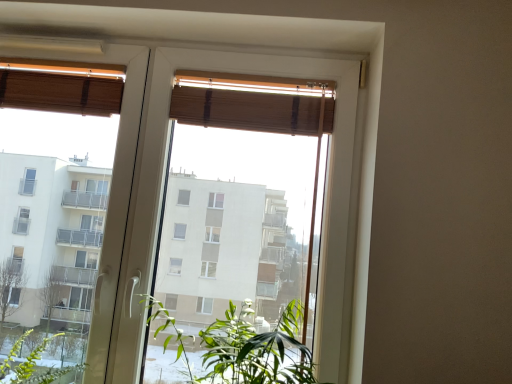
Image resolution: width=512 pixels, height=384 pixels. Find the location of `wooden blind at upper left, arranged as the 1th curtain when viewed from the left`. wooden blind at upper left, arranged as the 1th curtain when viewed from the left is located at coordinates (60, 93).

The height and width of the screenshot is (384, 512). What do you see at coordinates (242, 348) in the screenshot? I see `green leafy plant at center` at bounding box center [242, 348].

Locate an element on the screen. Image resolution: width=512 pixels, height=384 pixels. wooden blind at upper left, which ranks as the 2th curtain in right-to-left order is located at coordinates (60, 93).

From the image's perspective, which one is positioned lower, wooden blinds at upper center or wooden blind at upper left, which ranks as the 2th curtain in right-to-left order?

From the image's view, wooden blinds at upper center is below.

Where is `the 2nd curtain behind the wooden blinds at upper center, counting from the anchor's position`? Image resolution: width=512 pixels, height=384 pixels. the 2nd curtain behind the wooden blinds at upper center, counting from the anchor's position is located at coordinates (60, 93).

Considering the relative positions of wooden blinds at upper center and wooden blind at upper left, which ranks as the 2th curtain in right-to-left order, in the image provided, is wooden blinds at upper center behind wooden blind at upper left, which ranks as the 2th curtain in right-to-left order,?

That is False.

Considering the positions of objects wooden blinds at upper center and wooden blind at upper left, which ranks as the 2th curtain in right-to-left order, in the image provided, who is more to the left, wooden blinds at upper center or wooden blind at upper left, which ranks as the 2th curtain in right-to-left order,?

wooden blind at upper left, which ranks as the 2th curtain in right-to-left order, is more to the left.

Considering the relative sizes of green leafy plant at center and wooden blind at upper center, which is the 1th curtain from right to left, in the image provided, is green leafy plant at center bigger than wooden blind at upper center, which is the 1th curtain from right to left,?

Yes, green leafy plant at center is bigger than wooden blind at upper center, which is the 1th curtain from right to left.

Is point (244, 315) closer or farther from the camera than point (200, 89)?

Point (244, 315) appears to be closer to the viewer than point (200, 89).

Considering the positions of objects green leafy plant at center and wooden blind at upper center, which is the 2th curtain in left-to-right order, in the image provided, who is in front, green leafy plant at center or wooden blind at upper center, which is the 2th curtain in left-to-right order,?

green leafy plant at center is more forward.

Which is correct: green leafy plant at center is inside wooden blind at upper center, which is the 1th curtain from right to left, or outside of it?

green leafy plant at center is not inside wooden blind at upper center, which is the 1th curtain from right to left, it's outside.

Between green leafy plant at center and wooden blind at upper left, which ranks as the 2th curtain in right-to-left order, which one has larger size?

green leafy plant at center is bigger.

Is green leafy plant at center next to wooden blind at upper left, which ranks as the 2th curtain in right-to-left order?

No, green leafy plant at center is not beside wooden blind at upper left, which ranks as the 2th curtain in right-to-left order.

Which is in front, green leafy plant at center or wooden blind at upper left, arranged as the 1th curtain when viewed from the left?

green leafy plant at center is in front.

Is point (227, 322) closer or farther from the camera than point (70, 85)?

Point (227, 322).

Based on the photo, from a real-world perspective, is wooden blind at upper left, arranged as the 1th curtain when viewed from the left, positioned above or below green leafy plant at center?

wooden blind at upper left, arranged as the 1th curtain when viewed from the left, is above green leafy plant at center.

Consider the image. Looking at their sizes, would you say wooden blind at upper left, arranged as the 1th curtain when viewed from the left, is wider or thinner than green leafy plant at center?

Clearly, wooden blind at upper left, arranged as the 1th curtain when viewed from the left, has less width compared to green leafy plant at center.

Is wooden blind at upper left, arranged as the 1th curtain when viewed from the left, in front of or behind green leafy plant at center in the image?

Clearly, wooden blind at upper left, arranged as the 1th curtain when viewed from the left, is behind green leafy plant at center.

Is green leafy plant at center located within wooden blind at upper center, which is the 1th curtain from right to left?

No.

From the picture: Considering the relative sizes of wooden blind at upper center, which is the 2th curtain in left-to-right order, and green leafy plant at center in the image provided, is wooden blind at upper center, which is the 2th curtain in left-to-right order, taller than green leafy plant at center?

No, wooden blind at upper center, which is the 2th curtain in left-to-right order, is not taller than green leafy plant at center.

Considering the relative sizes of wooden blind at upper center, which is the 2th curtain in left-to-right order, and green leafy plant at center in the image provided, is wooden blind at upper center, which is the 2th curtain in left-to-right order, smaller than green leafy plant at center?

Correct, wooden blind at upper center, which is the 2th curtain in left-to-right order, occupies less space than green leafy plant at center.

Which of these two, wooden blind at upper center, which is the 2th curtain in left-to-right order, or green leafy plant at center, is wider?

green leafy plant at center is wider.

Is green leafy plant at center surrounding wooden blinds at upper center?

No, wooden blinds at upper center is not surrounded by green leafy plant at center.

Is green leafy plant at center smaller than wooden blinds at upper center?

Indeed, green leafy plant at center has a smaller size compared to wooden blinds at upper center.

From the picture: Is green leafy plant at center far away from wooden blinds at upper center?

No, green leafy plant at center is not far away from wooden blinds at upper center.

Is green leafy plant at center aimed at wooden blinds at upper center?

No, green leafy plant at center is not facing towards wooden blinds at upper center.

Is wooden blinds at upper center aimed at green leafy plant at center?

Yes, wooden blinds at upper center is facing green leafy plant at center.

Looking at this image, who is bigger, wooden blinds at upper center or green leafy plant at center?

With larger size is wooden blinds at upper center.

Would you consider wooden blinds at upper center to be distant from green leafy plant at center?

They are positioned close to each other.

Identify the location of window below the wooden blind at upper left, which ranks as the 2th curtain in right-to-left order (from a real-world perspective). The height and width of the screenshot is (384, 512). (162, 187).

Where is `curtain that appears on the right of green leafy plant at center`? curtain that appears on the right of green leafy plant at center is located at coordinates (246, 110).

Based on their spatial positions, is wooden blinds at upper center or green leafy plant at center closer to wooden blind at upper left, arranged as the 1th curtain when viewed from the left?

wooden blinds at upper center.

When comparing their distances from wooden blinds at upper center, does wooden blind at upper left, which ranks as the 2th curtain in right-to-left order, or green leafy plant at center seem closer?

wooden blind at upper left, which ranks as the 2th curtain in right-to-left order, lies closer to wooden blinds at upper center than the other object.

Based on their spatial positions, is green leafy plant at center or wooden blinds at upper center further from wooden blind at upper left, arranged as the 1th curtain when viewed from the left?

green leafy plant at center.

Which object lies further to the anchor point wooden blind at upper center, which is the 2th curtain in left-to-right order, wooden blind at upper left, which ranks as the 2th curtain in right-to-left order, or green leafy plant at center?

green leafy plant at center is further to wooden blind at upper center, which is the 2th curtain in left-to-right order.

Based on their spatial positions, is wooden blind at upper center, which is the 2th curtain in left-to-right order, or wooden blind at upper left, arranged as the 1th curtain when viewed from the left, further from wooden blinds at upper center?

The object further to wooden blinds at upper center is wooden blind at upper left, arranged as the 1th curtain when viewed from the left.

In the scene shown: When comparing their distances from wooden blind at upper center, which is the 1th curtain from right to left, does green leafy plant at center or wooden blinds at upper center seem further?

Based on the image, green leafy plant at center appears to be further to wooden blind at upper center, which is the 1th curtain from right to left.

Which object lies further to the anchor point wooden blind at upper left, arranged as the 1th curtain when viewed from the left, wooden blinds at upper center or wooden blind at upper center, which is the 1th curtain from right to left?

wooden blind at upper center, which is the 1th curtain from right to left.

In the scene shown: Which object lies nearer to the anchor point wooden blind at upper left, which ranks as the 2th curtain in right-to-left order, wooden blind at upper center, which is the 1th curtain from right to left, or wooden blinds at upper center?

Based on the image, wooden blinds at upper center appears to be nearer to wooden blind at upper left, which ranks as the 2th curtain in right-to-left order.

This screenshot has height=384, width=512. Find the location of `window between wooden blind at upper center, which is the 2th curtain in left-to-right order, and green leafy plant at center in the up-down direction`. window between wooden blind at upper center, which is the 2th curtain in left-to-right order, and green leafy plant at center in the up-down direction is located at coordinates (162, 187).

The width and height of the screenshot is (512, 384). I want to click on window that lies between wooden blind at upper left, arranged as the 1th curtain when viewed from the left, and green leafy plant at center from top to bottom, so click(x=162, y=187).

Where is `window between wooden blind at upper left, arranged as the 1th curtain when viewed from the left, and wooden blind at upper center, which is the 2th curtain in left-to-right order, in the horizontal direction`? window between wooden blind at upper left, arranged as the 1th curtain when viewed from the left, and wooden blind at upper center, which is the 2th curtain in left-to-right order, in the horizontal direction is located at coordinates (162, 187).

At what (x,y) coordinates should I click in order to perform the action: click on curtain that lies between wooden blind at upper left, which ranks as the 2th curtain in right-to-left order, and green leafy plant at center from top to bottom. Please return your answer as a coordinate pair (x, y). This screenshot has width=512, height=384. Looking at the image, I should click on (246, 110).